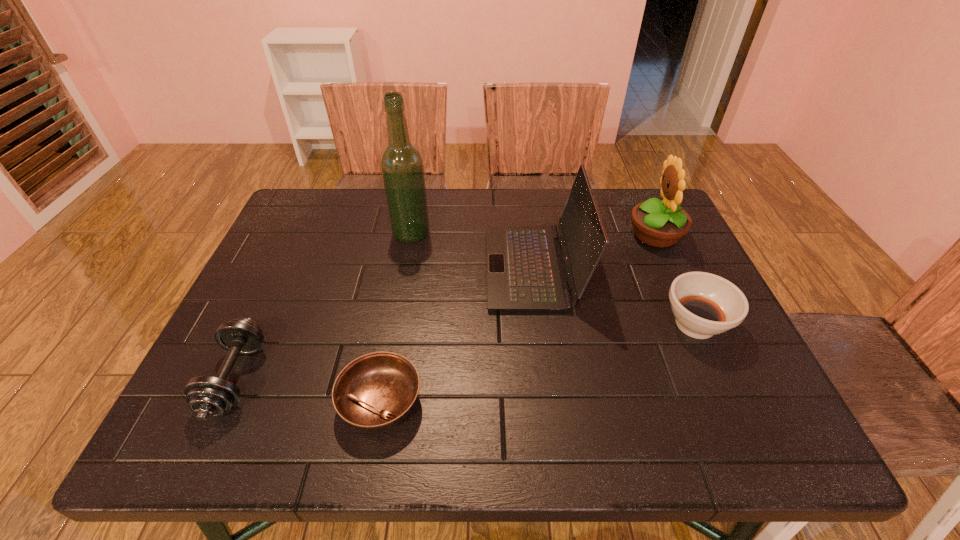
Image resolution: width=960 pixels, height=540 pixels. I want to click on free point between the taller soup bowl and the dumbbell, so click(466, 352).

I want to click on free spot between the sunflower and the leftmost object, so click(445, 307).

You are a GUI agent. You are given a task and a screenshot of the screen. Output one action in this format:
    pyautogui.click(x=<x>, y=<y>)
    Task: Click on the closest object to the laptop computer
    
    Given the screenshot: What is the action you would take?
    pyautogui.click(x=704, y=304)

Where is `object that is the fifth closest to the sunflower`? The height and width of the screenshot is (540, 960). object that is the fifth closest to the sunflower is located at coordinates (207, 396).

The width and height of the screenshot is (960, 540). What are the coordinates of `free space that satisfies the following two spatial constraints: 1. on the back side of the nearer soup bowl; 2. on the left side of the liquor` in the screenshot? It's located at (411, 233).

At what (x,y) coordinates should I click in order to perform the action: click on free space that satisfies the following two spatial constraints: 1. on the screen of the laptop computer; 2. on the back side of the taller soup bowl. Please return your answer as a coordinate pair (x, y). The height and width of the screenshot is (540, 960). Looking at the image, I should click on (540, 325).

At what (x,y) coordinates should I click in order to perform the action: click on free spot that satisfies the following two spatial constraints: 1. on the back side of the liquor; 2. on the left side of the left soup bowl. Please return your answer as a coordinate pair (x, y). Looking at the image, I should click on (411, 233).

At what (x,y) coordinates should I click in order to perform the action: click on vacant space that satisfies the following two spatial constraints: 1. on the back side of the left soup bowl; 2. on the left side of the farther soup bowl. Please return your answer as a coordinate pair (x, y). This screenshot has height=540, width=960. Looking at the image, I should click on 395,325.